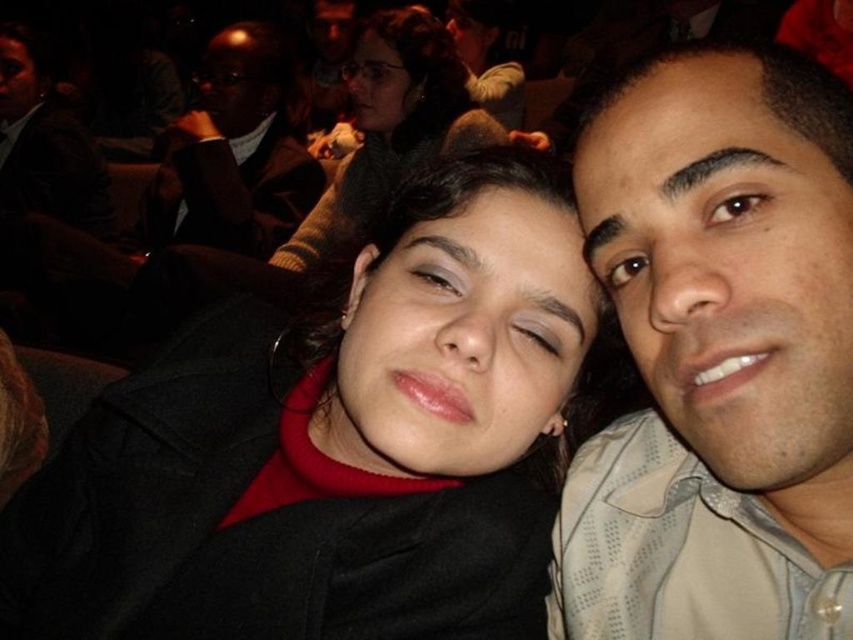
Question: Which of the following is the closest to the observer?

Choices:
 (A) (157, 230)
 (B) (357, 176)
 (C) (358, 609)

Answer: (C)

Question: Does black matte jacket at center appear over matte black hair at upper center?

Choices:
 (A) yes
 (B) no

Answer: (B)

Question: Which of these objects is positioned farthest from the black matte jacket at center?

Choices:
 (A) matte beige shirt at right
 (B) matte black hair at upper center
 (C) matte black suit at upper left

Answer: (C)

Question: Among these points, which one is farthest from the camera?

Choices:
 (A) coord(238,307)
 (B) coord(834,547)
 (C) coord(218,129)

Answer: (C)

Question: Can you confirm if matte beige shirt at right is smaller than matte black suit at upper left?

Choices:
 (A) no
 (B) yes

Answer: (B)

Question: Does matte beige shirt at right lie behind matte black suit at upper left?

Choices:
 (A) no
 (B) yes

Answer: (A)